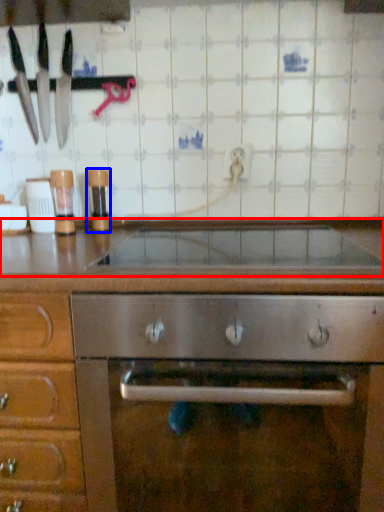
Question: Which object is closer to the camera taking this photo, countertop (highlighted by a red box) or appliance (highlighted by a blue box)?

Choices:
 (A) countertop
 (B) appliance

Answer: (A)